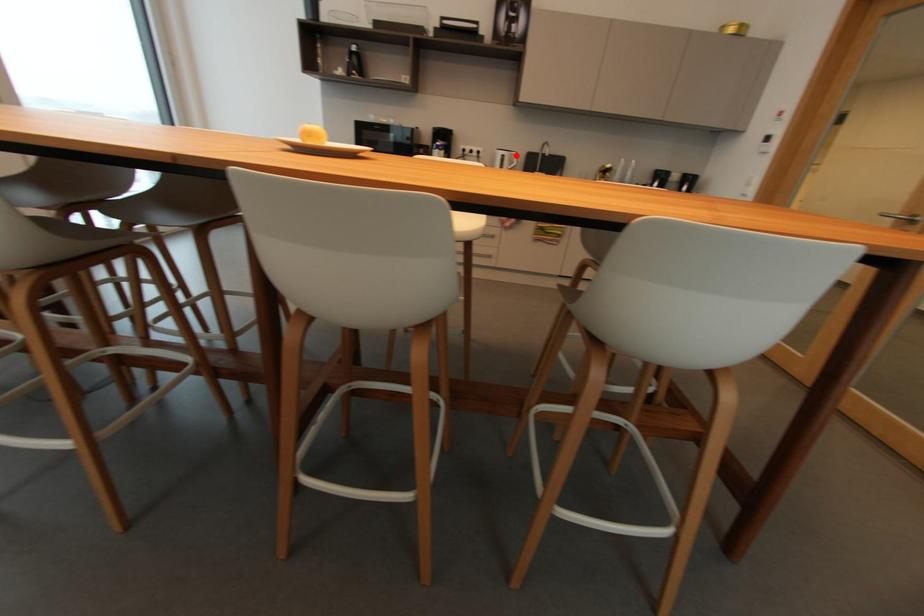
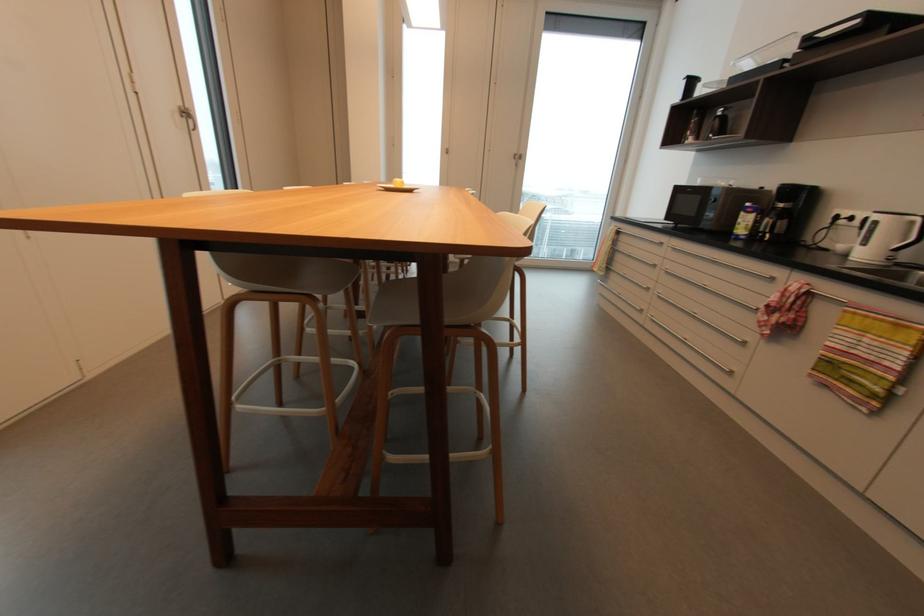
Find the pixel in the second image that matches the highlighted location in the first image.

(916, 223)